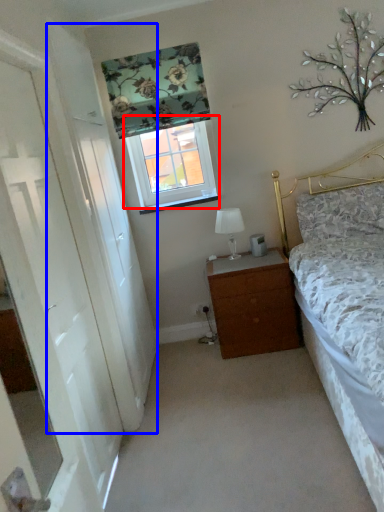
Question: Which of the following is the farthest to the observer, window (highlighted by a red box) or screen door (highlighted by a blue box)?

Choices:
 (A) window
 (B) screen door

Answer: (A)